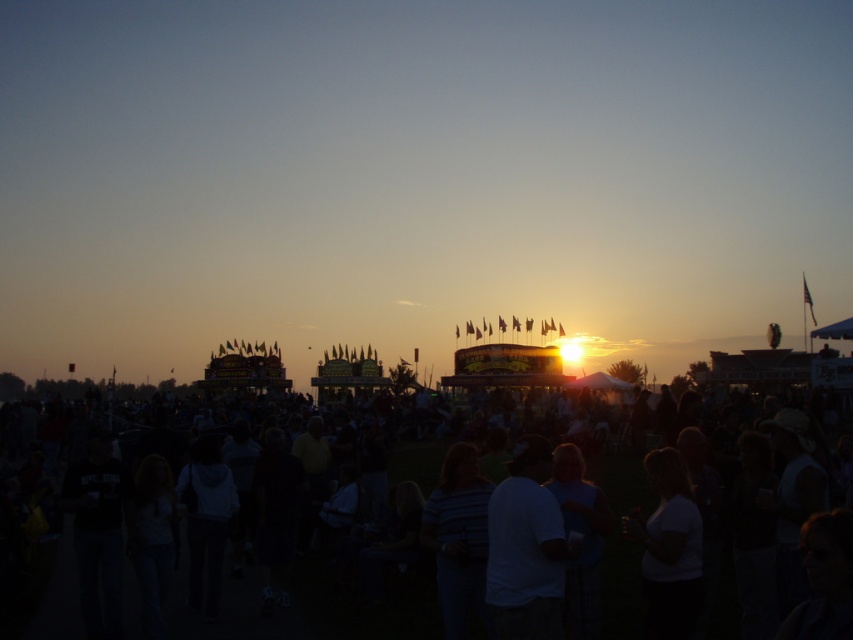
Question: Is black matte crowd at center above white matte shirt at center?

Choices:
 (A) no
 (B) yes

Answer: (B)

Question: Among these points, which one is nearest to the camera?

Choices:
 (A) (115, 500)
 (B) (519, 624)

Answer: (B)

Question: Does black matte crowd at center come behind white matte shirt at center?

Choices:
 (A) yes
 (B) no

Answer: (B)

Question: Can you confirm if black matte crowd at center is smaller than white matte shirt at center?

Choices:
 (A) no
 (B) yes

Answer: (A)

Question: Which point is closer to the camera taking this photo?

Choices:
 (A) [x=483, y=541]
 (B) [x=509, y=604]

Answer: (B)